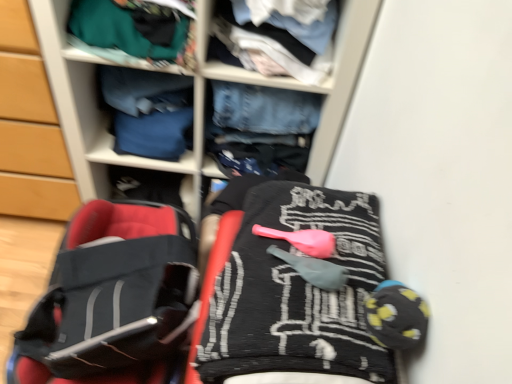
Question: From the image's perspective, relative to black fabric baby carriage at lower left, is light blue cotton shirt at upper center, which is the second clothing in front-to-back order, above or below?

Choices:
 (A) above
 (B) below

Answer: (A)

Question: In terms of width, does light blue cotton shirt at upper center, which is the second clothing in front-to-back order, look wider or thinner when compared to black fabric baby carriage at lower left?

Choices:
 (A) wide
 (B) thin

Answer: (B)

Question: Considering the real-world distances, which object is closest to the wooden cabinet at left?

Choices:
 (A) teal fabric at upper left, which ranks as the third clothing in front-to-back order
 (B) black textured blanket at center, which is the 1th clothing in front-to-back order
 (C) black fabric baby carriage at lower left
 (D) light blue cotton shirt at upper center, which is counted as the third clothing, starting from the back
 (E) denim jeans at center

Answer: (E)

Question: Which object is positioned farthest from the denim jeans at center?

Choices:
 (A) teal fabric at upper left, the second clothing from the back
 (B) black textured blanket at center, which is the 1th clothing in front-to-back order
 (C) wooden cabinet at left
 (D) light blue cotton shirt at upper center, which is counted as the third clothing, starting from the back
 (E) blue denim jeans at center, acting as the first clothing starting from the back

Answer: (B)